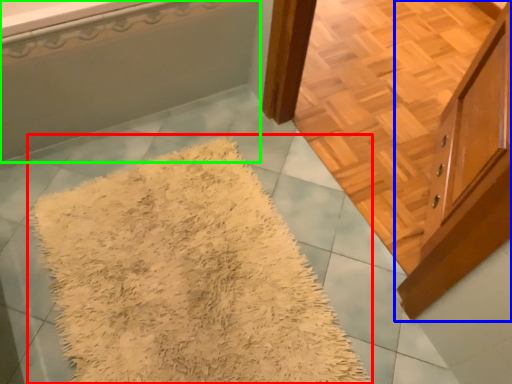
Question: Estimate the real-world distances between objects in this image. Which object is farther from mat (highlighted by a red box), cabinetry (highlighted by a blue box) or bathtub (highlighted by a green box)?

Choices:
 (A) cabinetry
 (B) bathtub

Answer: (A)